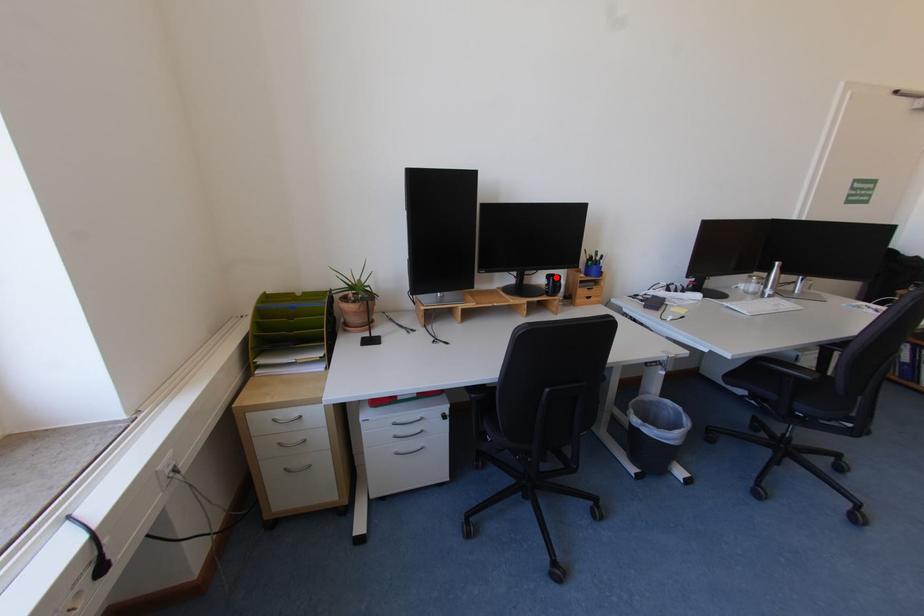
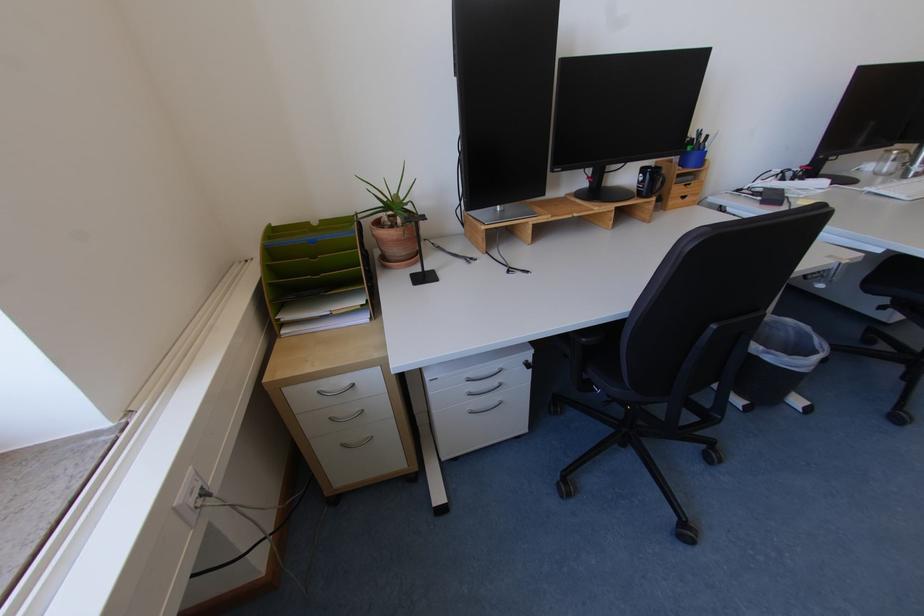
In the second image, find the point that corresponds to the highlighted location in the first image.

(650, 171)